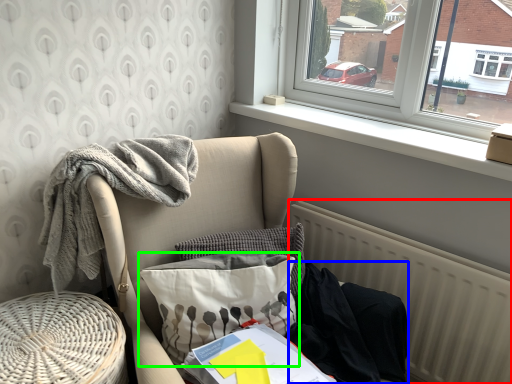
Question: Which object is positioned farthest from radiator (highlighted by a red box)? Select from clothing (highlighted by a blue box) and pillow (highlighted by a green box).

Choices:
 (A) clothing
 (B) pillow

Answer: (B)